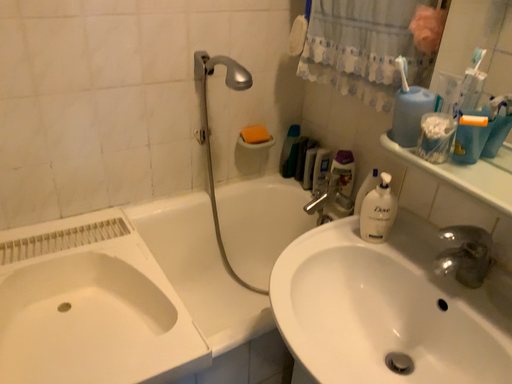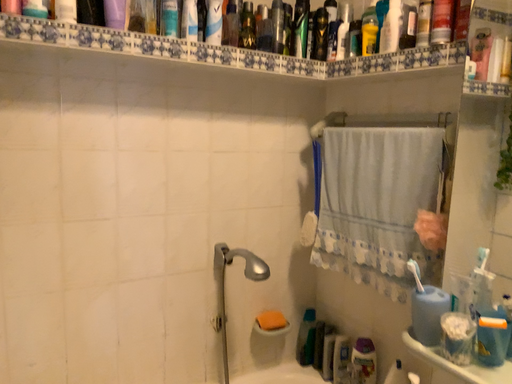
Question: Which way did the camera rotate in the video?

Choices:
 (A) rotated upward
 (B) rotated downward

Answer: (A)